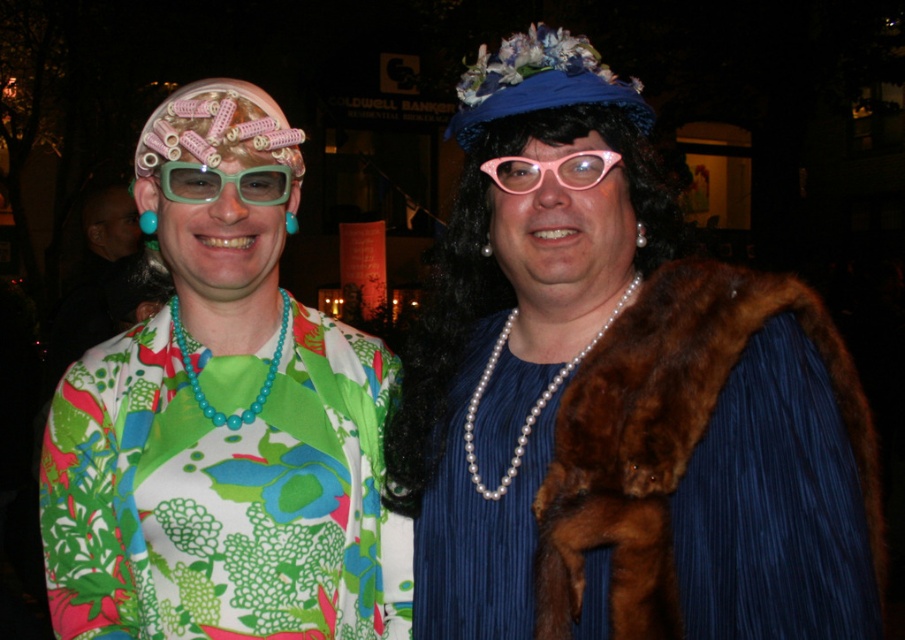
Question: Is brown fur coat at right behind matte green plastic goggles at upper left?

Choices:
 (A) no
 (B) yes

Answer: (A)

Question: Considering the relative positions of matte plastic wig at left and pink plastic glasses at center in the image provided, where is matte plastic wig at left located with respect to pink plastic glasses at center?

Choices:
 (A) above
 (B) below

Answer: (B)

Question: From the image, what is the correct spatial relationship of matte plastic wig at left in relation to pink plastic glasses at center?

Choices:
 (A) right
 (B) left

Answer: (B)

Question: Which object appears farthest from the camera in this image?

Choices:
 (A) pearl necklace fur coat at center
 (B) matte plastic wig at left
 (C) pink plastic glasses at center
 (D) matte green plastic goggles at upper left

Answer: (D)

Question: Based on their relative distances, which object is farther from the pearl necklace fur coat at center?

Choices:
 (A) pink plastic glasses at center
 (B) brown fur coat at right
 (C) matte green plastic goggles at upper left

Answer: (C)

Question: Among these points, which one is nearest to the camera?

Choices:
 (A) (212, 189)
 (B) (545, 161)
 (C) (135, 600)

Answer: (B)